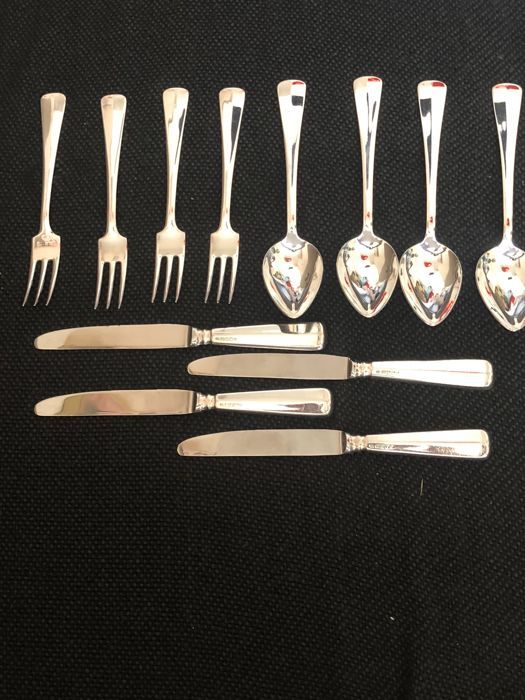
The image size is (525, 700). I want to click on forks, so click(x=44, y=242), click(x=112, y=246), click(x=173, y=238), click(x=233, y=242).